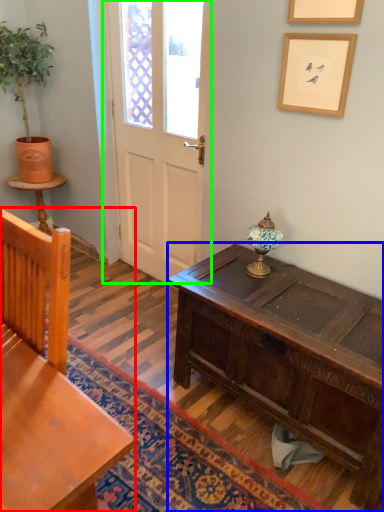
Question: Which object is the farthest from chair (highlighted by a red box)? Choose among these: desk (highlighted by a blue box) or door (highlighted by a green box).

Choices:
 (A) desk
 (B) door

Answer: (B)